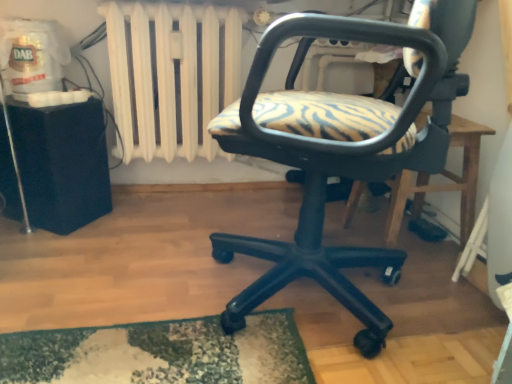
The image size is (512, 384). I want to click on free space in front of black plastic table at left, marked as the 1th table in a left-to-right arrangement, so click(x=42, y=251).